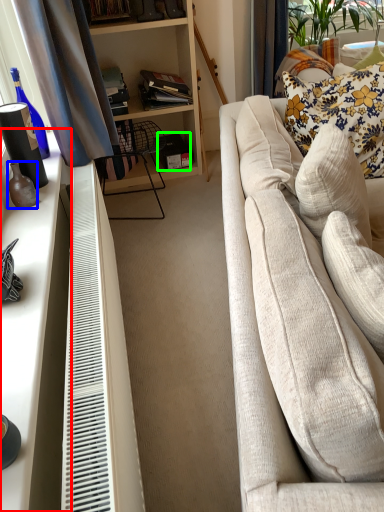
Question: Based on their relative distances, which object is farther from desk (highlighted by a red box)? Choose from bottle (highlighted by a blue box) and box (highlighted by a green box).

Choices:
 (A) bottle
 (B) box

Answer: (B)